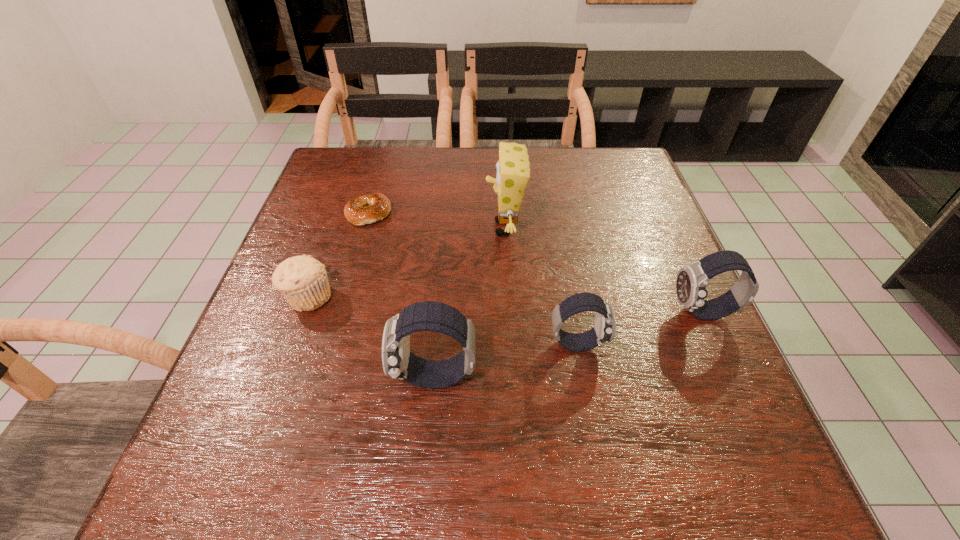
This screenshot has width=960, height=540. I want to click on the fourth object from right to left, so click(398, 362).

The height and width of the screenshot is (540, 960). I want to click on the shortest watch, so click(x=604, y=329).

Where is `the fifth object from left to right`? Image resolution: width=960 pixels, height=540 pixels. the fifth object from left to right is located at coordinates (604, 329).

You are a GUI agent. You are given a task and a screenshot of the screen. Output one action in this format:
    pyautogui.click(x=<x>, y=<y>)
    Task: Click on the rightmost object
    This screenshot has height=540, width=960.
    Given the screenshot: What is the action you would take?
    pyautogui.click(x=691, y=284)

You are a GUI agent. You are given a task and a screenshot of the screen. Output one action in this format:
    pyautogui.click(x=<x>, y=<y>)
    Task: Click on the fourth shortest object
    The height and width of the screenshot is (540, 960).
    Given the screenshot: What is the action you would take?
    pyautogui.click(x=691, y=284)

Where is `the shortest object`? Image resolution: width=960 pixels, height=540 pixels. the shortest object is located at coordinates (366, 209).

I want to click on sponge, so click(513, 173).

Find the location of a particular element. The image size is (960, 540). the second shortest object is located at coordinates (303, 281).

Image resolution: width=960 pixels, height=540 pixels. In order to click on vacant space located on the face of the third object from left to right in this screenshot , I will do `click(265, 377)`.

Locate an element on the screen. free region located on the face of the third object from left to right is located at coordinates (337, 377).